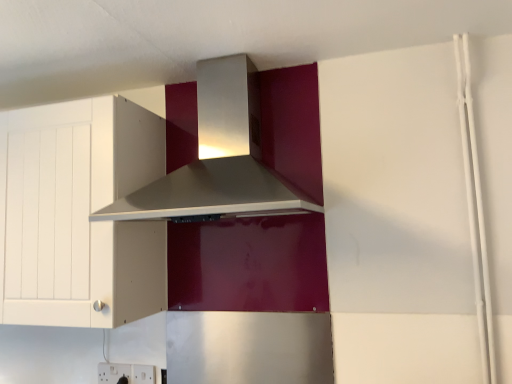
Question: From the image's perspective, is satin silver range hood at upper center located above or below white matte cabinet at left?

Choices:
 (A) above
 (B) below

Answer: (A)

Question: Is satin silver range hood at upper center bigger or smaller than white matte cabinet at left?

Choices:
 (A) small
 (B) big

Answer: (A)

Question: Estimate the real-world distances between objects in this image. Which object is closer to the white plastic electric outlet at lower left, marked as the 1th electric outlet in a left-to-right arrangement?

Choices:
 (A) satin silver range hood at upper center
 (B) white matte cabinet at left
 (C) white plastic electric outlet at lower center, the second electric outlet from the left

Answer: (C)

Question: Which of these objects is positioned farthest from the satin silver range hood at upper center?

Choices:
 (A) white matte cabinet at left
 (B) white plastic electric outlet at lower center, placed as the 1th electric outlet when sorted from right to left
 (C) white plastic electric outlet at lower left, marked as the 1th electric outlet in a left-to-right arrangement

Answer: (C)